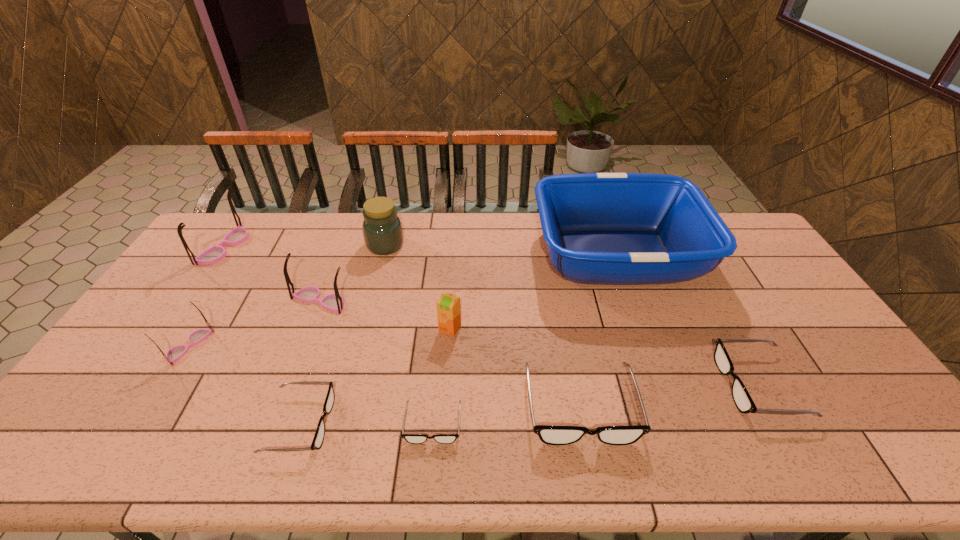
Find the location of a particular element. The height and width of the screenshot is (540, 960). blue tray is located at coordinates (600, 228).

The width and height of the screenshot is (960, 540). What are the coordinates of `the farthest spectacles` in the screenshot? It's located at (214, 254).

Image resolution: width=960 pixels, height=540 pixels. In order to click on the farthest pink spectacles in this screenshot , I will do `click(214, 254)`.

This screenshot has height=540, width=960. I want to click on jar, so click(382, 229).

Find the location of a particular element. This screenshot has height=540, width=960. the second tallest spectacles is located at coordinates (334, 302).

Find the location of `the rightmost pink spectacles`. the rightmost pink spectacles is located at coordinates (334, 302).

This screenshot has height=540, width=960. In order to click on orange juice in this screenshot , I will do `click(448, 305)`.

Where is `the third tallest spectacles`? The image size is (960, 540). the third tallest spectacles is located at coordinates (177, 352).

Where is `the smallest pink spectacles`? Image resolution: width=960 pixels, height=540 pixels. the smallest pink spectacles is located at coordinates (177, 352).

You are a GUI agent. You are given a task and a screenshot of the screen. Output one action in this format:
    pyautogui.click(x=<x>, y=<y>)
    Task: Click on the fourth shortest spectacles
    This screenshot has height=540, width=960.
    Given the screenshot: What is the action you would take?
    pyautogui.click(x=552, y=435)